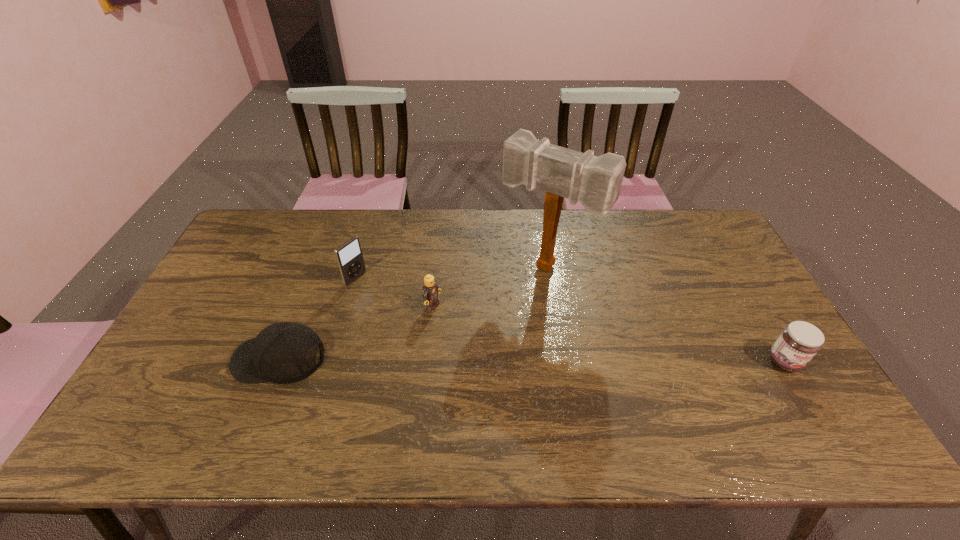
Identify the location of object that is at the far edge. The image size is (960, 540). click(595, 182).

Identify the location of object situated at the near edge. (285, 352).

The image size is (960, 540). I want to click on object at the right edge, so click(799, 342).

You are a GUI agent. You are given a task and a screenshot of the screen. Output one action in this format:
    pyautogui.click(x=<x>, y=<y>)
    Task: Click on the vacant space at the far edge
    
    Given the screenshot: What is the action you would take?
    pyautogui.click(x=636, y=248)

I want to click on vacant position at the near edge of the desktop, so click(x=229, y=397).

In the image, there is a desktop. At what (x,y) coordinates should I click in order to perform the action: click on free space at the left edge. Please return your answer as a coordinate pair (x, y). This screenshot has height=540, width=960. Looking at the image, I should click on point(179,348).

In the image, there is a desktop. Identify the location of free space at the right edge. The width and height of the screenshot is (960, 540). (713, 254).

Identify the location of free location at the far left corner. (x=271, y=235).

At what (x,y) coordinates should I click in order to perform the action: click on blank region between the cap and the rightmost object. Please return your answer as a coordinate pair (x, y). Image resolution: width=960 pixels, height=540 pixels. Looking at the image, I should click on (532, 360).

Locate an element on the screen. The width and height of the screenshot is (960, 540). free space that is in between the second tallest object and the mallet is located at coordinates (451, 273).